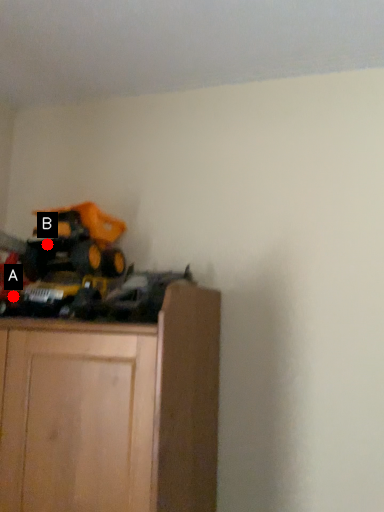
Question: Two points are circled on the image, labeled by A and B beside each circle. Which point is further to the camera?

Choices:
 (A) A is further
 (B) B is further

Answer: (B)